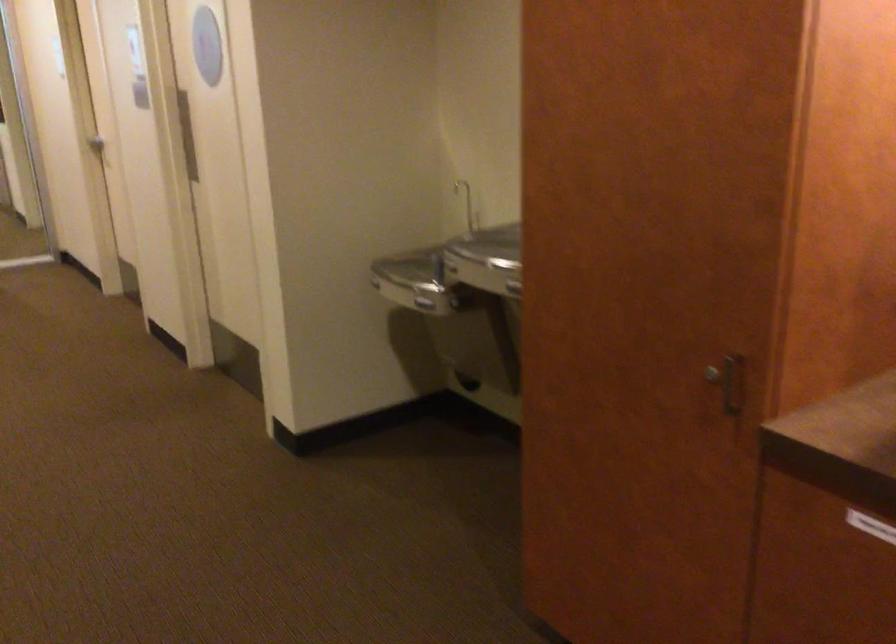
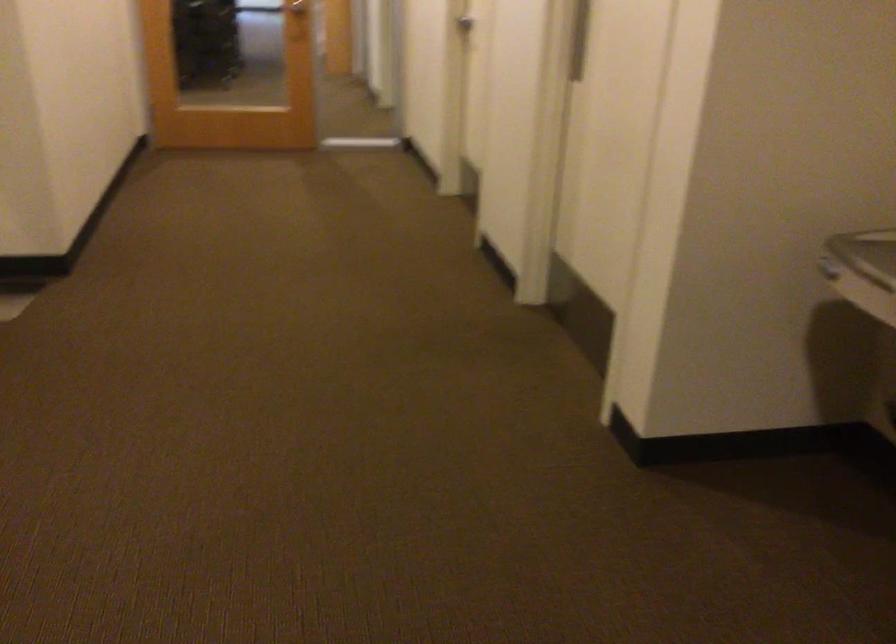
In the second image, find the point that corresponds to the point at 374,283 in the first image.

(829, 269)